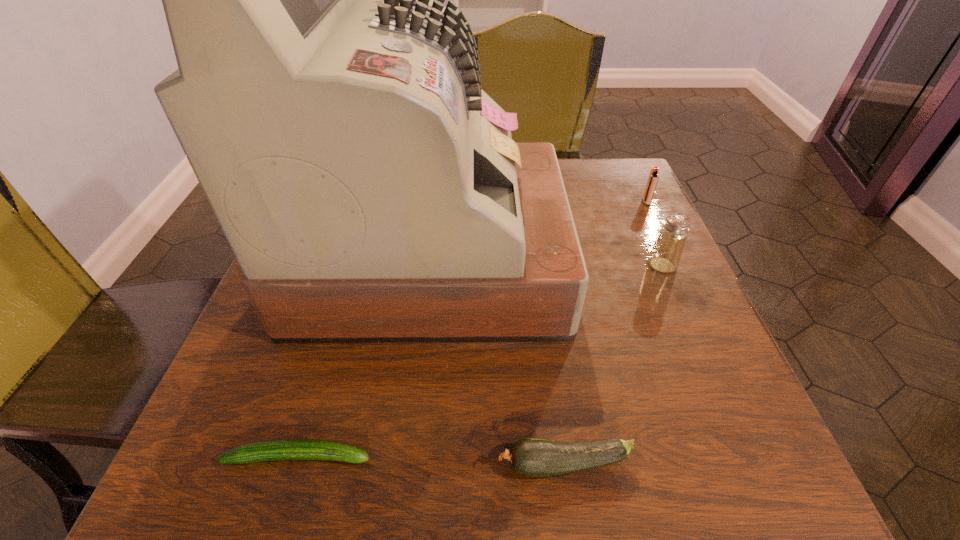
Find the location of a particular element. The image size is (960, 540). the tallest object is located at coordinates (330, 105).

The image size is (960, 540). What are the coordinates of `saltshaker` in the screenshot? It's located at (665, 255).

Identify the location of igniter. (653, 177).

Locate an element on the screen. The width and height of the screenshot is (960, 540). the right zucchini is located at coordinates (532, 457).

This screenshot has height=540, width=960. In order to click on the second shortest object in this screenshot , I will do `click(532, 457)`.

The image size is (960, 540). Find the location of `the shortest object`. the shortest object is located at coordinates (286, 449).

Find the location of a particular element. This screenshot has height=540, width=960. the left zucchini is located at coordinates (286, 449).

The width and height of the screenshot is (960, 540). I want to click on free space located 0.070m on the operating side of the cash register, so click(595, 257).

Where is `vacant space located on the front of the fourth shortest object`? The height and width of the screenshot is (540, 960). vacant space located on the front of the fourth shortest object is located at coordinates (747, 458).

Locate an element on the screen. vacant space located 0.120m on the front of the igniter is located at coordinates (663, 238).